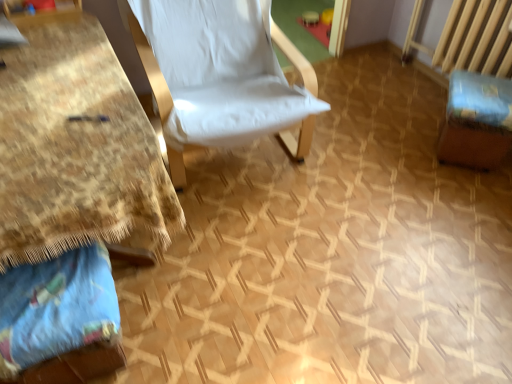
Locate an element on the screen. This screenshot has height=384, width=512. free space above wooden table at left (from a real-world perspective) is located at coordinates (65, 99).